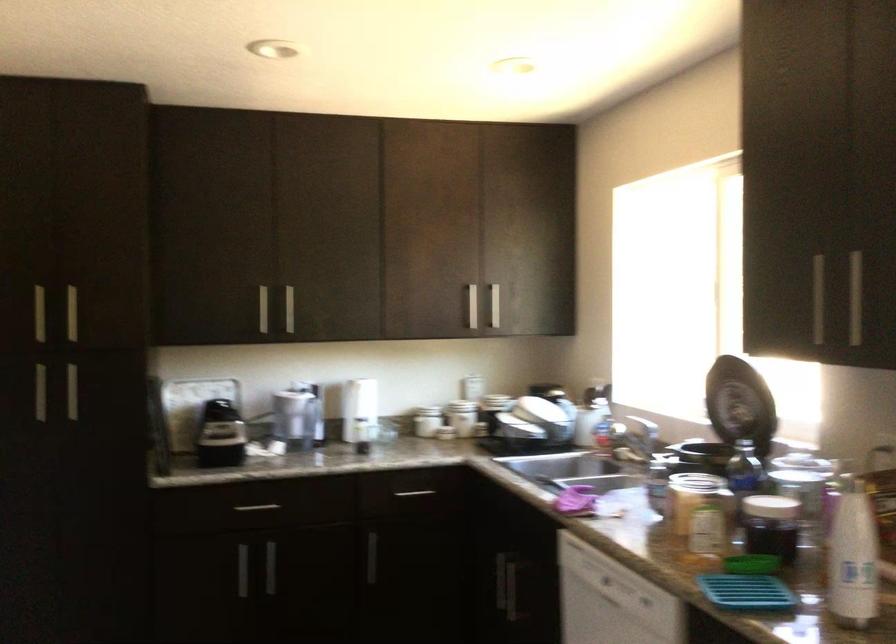
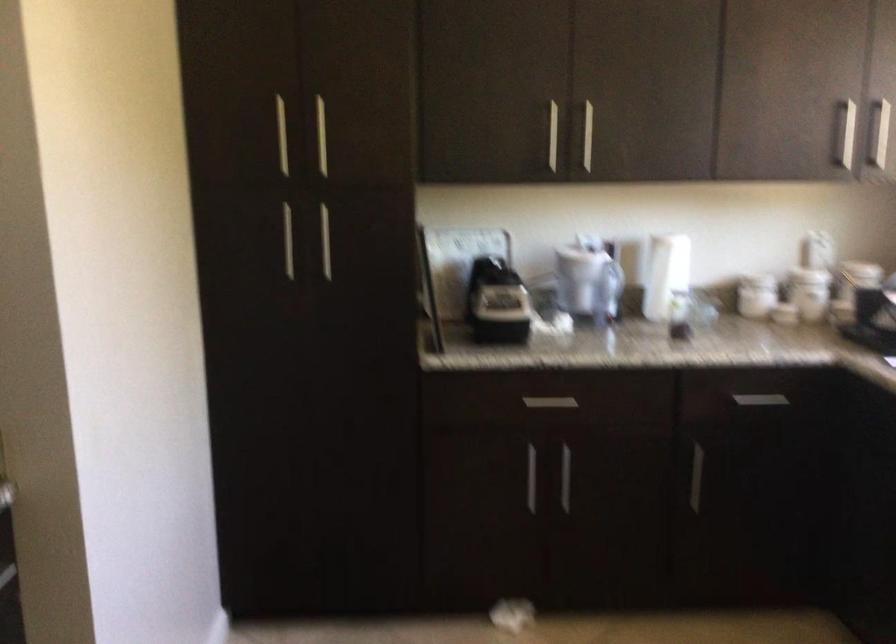
The point at (263,509) is marked in the first image. Where is the corresponding point in the second image?

(549, 402)